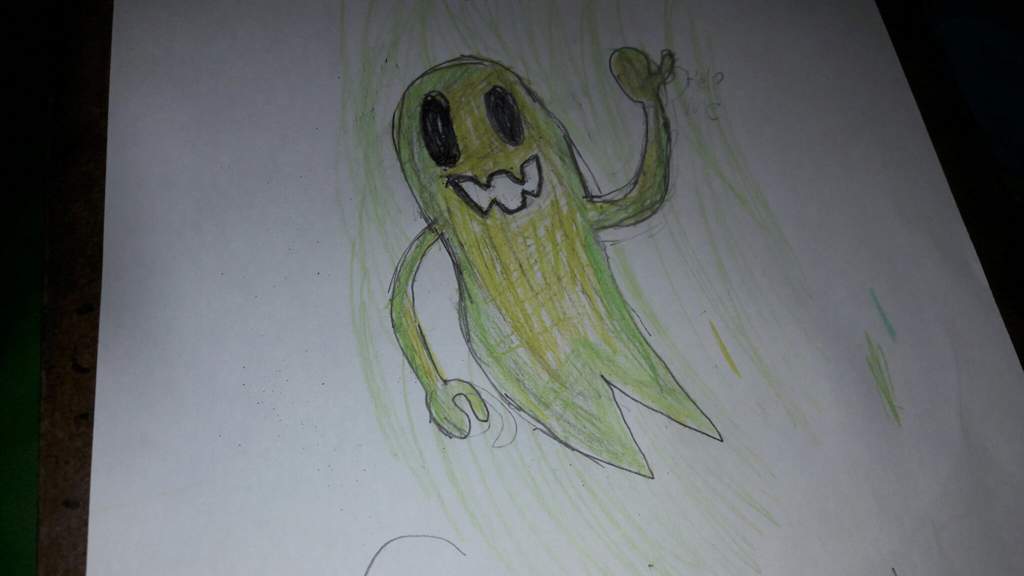
You are a GUI agent. You are given a task and a screenshot of the screen. Output one action in this format:
    pyautogui.click(x=<x>, y=<y>)
    Task: Click on the white rectangular piece paper
    
    Given the screenshot: What is the action you would take?
    pyautogui.click(x=246, y=63)